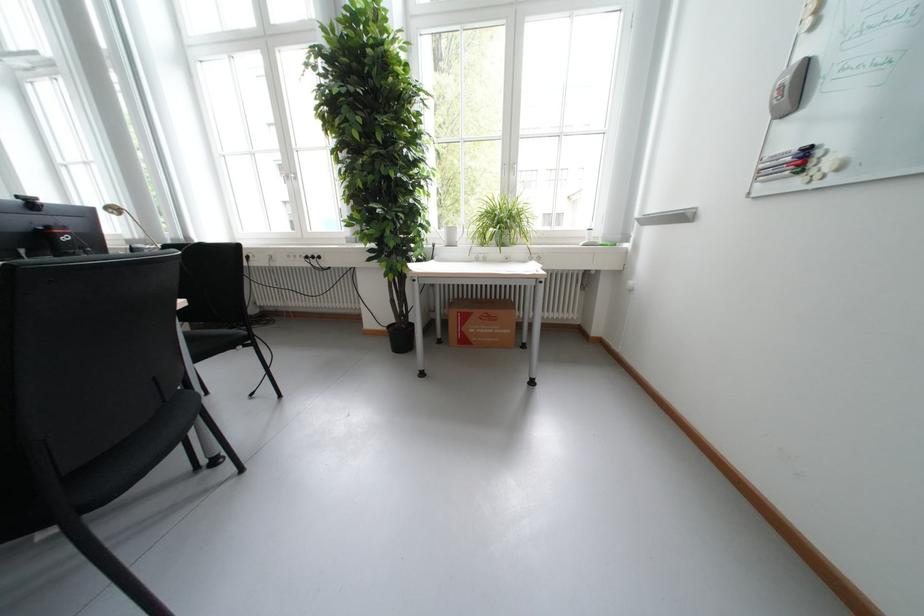
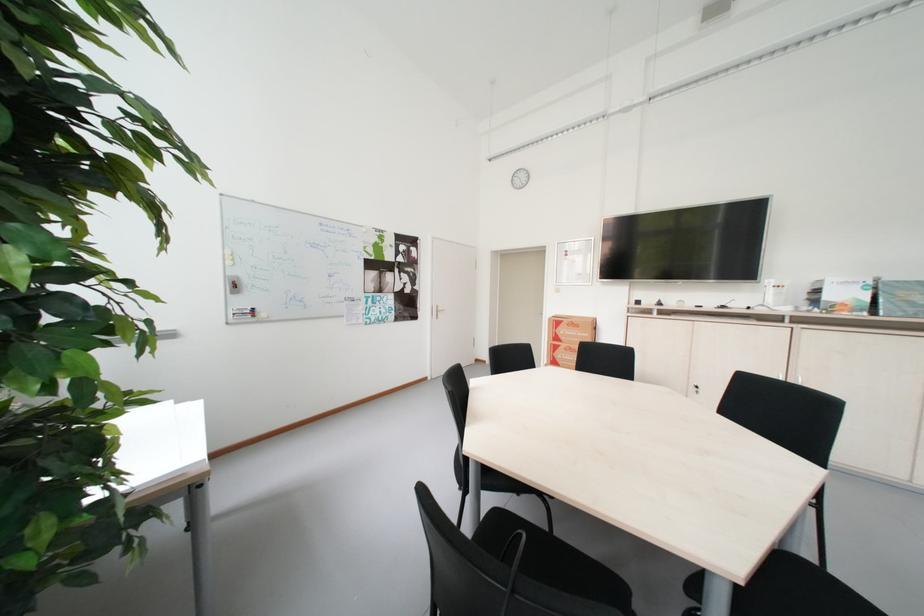
Question: I am providing you with two images of the same scene from different viewpoints. After the viewpoint changes to image2, which objects are now occluded?

Choices:
 (A) brown cardboard box
 (B) black chair sitting surface
 (C) brown stair handrail
 (D) grey whiteboard eraser

Answer: (D)